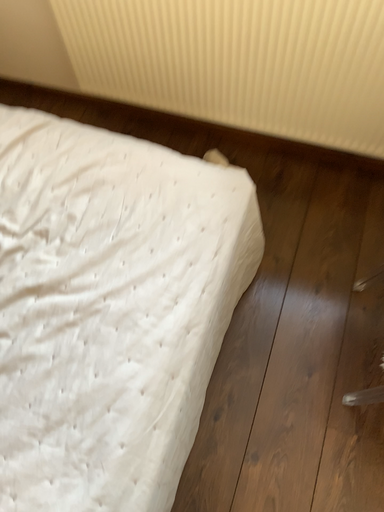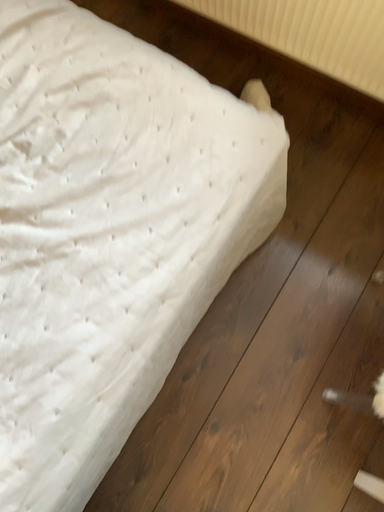
Question: How did the camera likely rotate when shooting the video?

Choices:
 (A) rotated downward
 (B) rotated upward

Answer: (A)